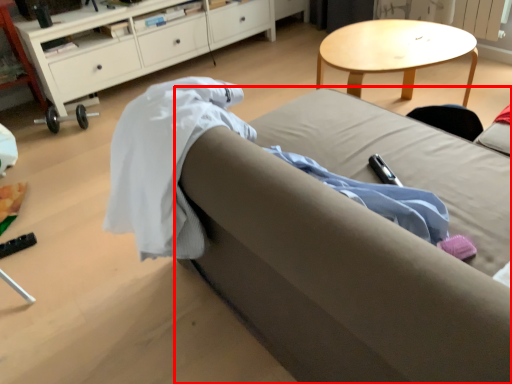
Question: Observing the image, what is the correct spatial positioning of studio couch (annotated by the red box) in reference to cabinetry?

Choices:
 (A) right
 (B) left

Answer: (A)